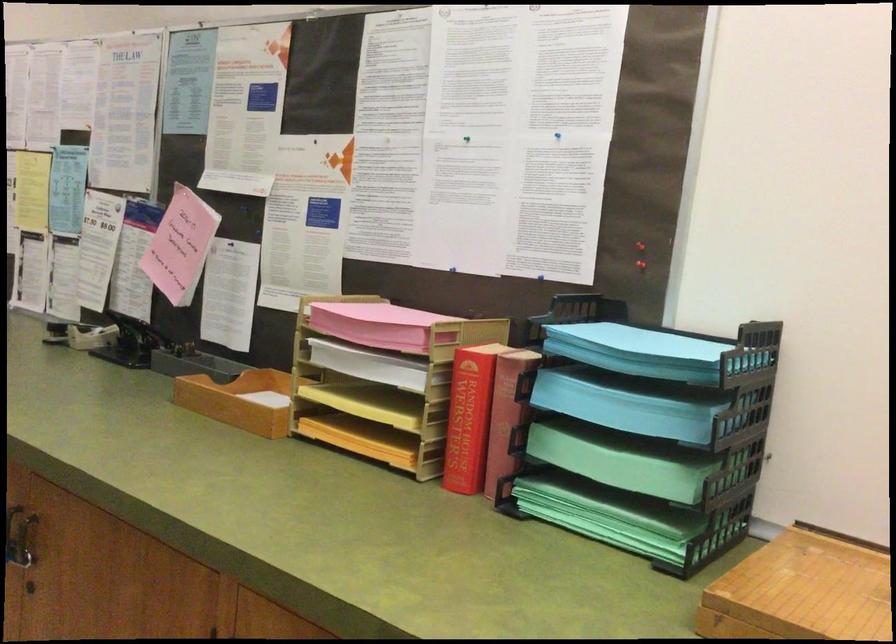
The image size is (896, 644). Describe the element at coordinates (20, 536) in the screenshot. I see `the hole punch handle` at that location.